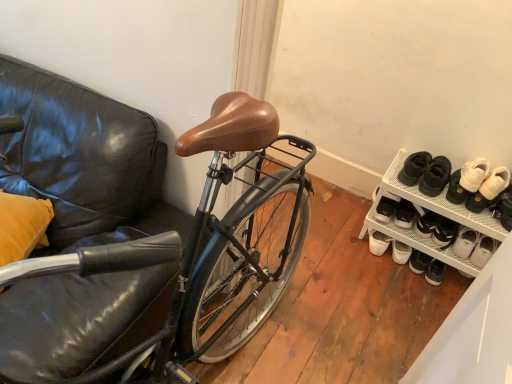
Locate an element on the screen. Image resolution: width=512 pixels, height=384 pixels. vacant area that lies in front of white mesh shoe rack at lower right is located at coordinates (399, 302).